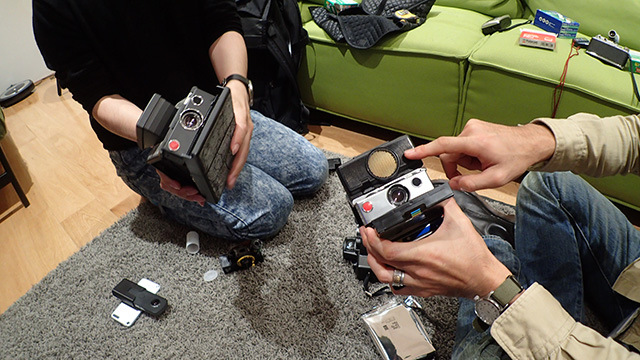
Where is `green sofa`? The height and width of the screenshot is (360, 640). green sofa is located at coordinates pyautogui.click(x=424, y=64).